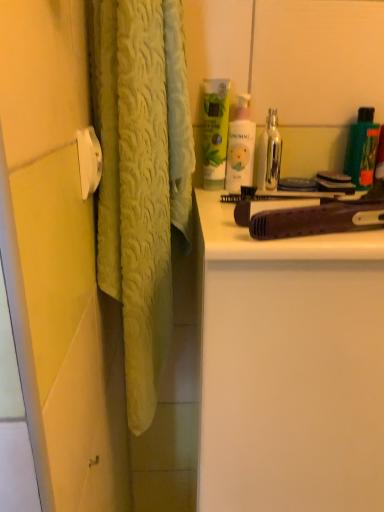
Question: Is pink matte lotion at upper center, marked as the first toiletry in a left-to-right arrangement, taller or shorter than green matte lotion at upper center?

Choices:
 (A) tall
 (B) short

Answer: (B)

Question: From a real-world perspective, is pink matte lotion at upper center, marked as the first toiletry in a left-to-right arrangement, above or below green matte lotion at upper center?

Choices:
 (A) below
 (B) above

Answer: (A)

Question: Estimate the real-world distances between objects in this image. Which object is closer to the pink matte lotion at upper center, which ranks as the second toiletry in right-to-left order?

Choices:
 (A) green plastic bottle at upper right, the second toiletry viewed from the left
 (B) metallic silver mouthwash at upper right, marked as the 2th mouthwash in a right-to-left arrangement
 (C) brown wood comb at upper right
 (D) white matte cabinet at right
 (E) green matte bottle at upper right, which ranks as the 2th mouthwash in left-to-right order

Answer: (B)

Question: Considering the real-world distances, which object is farthest from the white matte cabinet at right?

Choices:
 (A) green matte lotion at upper center
 (B) pink matte lotion at upper center, marked as the first toiletry in a left-to-right arrangement
 (C) metallic silver mouthwash at upper right, marked as the 2th mouthwash in a right-to-left arrangement
 (D) green matte bottle at upper right, which ranks as the 2th mouthwash in left-to-right order
 (E) green plastic bottle at upper right, the second toiletry viewed from the left

Answer: (E)